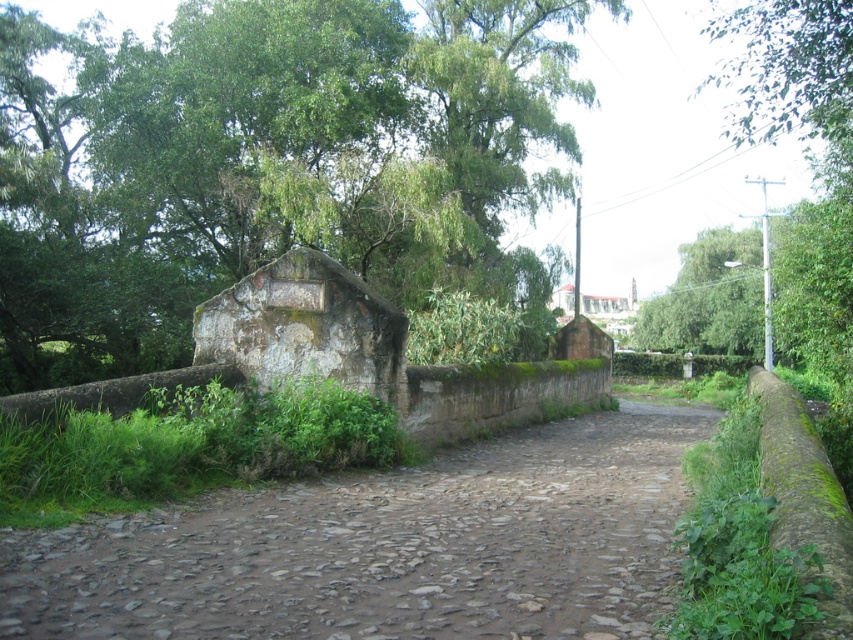
Is green leafy tree at upper center further to the viewer compared to brown stone path at center?

Yes, it is.

What do you see at coordinates (268, 163) in the screenshot? Image resolution: width=853 pixels, height=640 pixels. I see `green leafy tree at upper center` at bounding box center [268, 163].

Image resolution: width=853 pixels, height=640 pixels. Identify the location of green leafy tree at upper center. (268, 163).